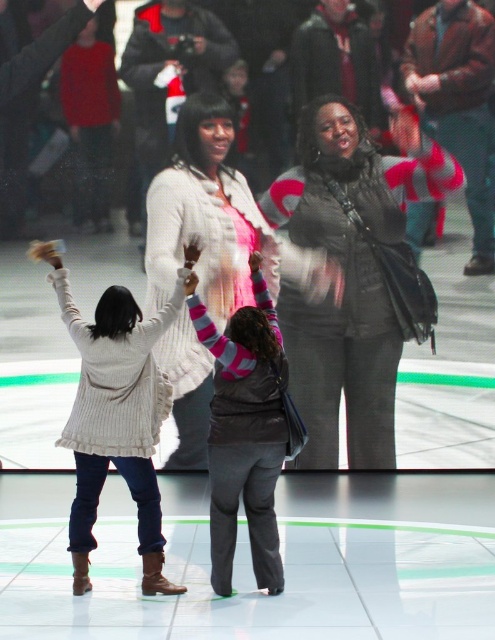
Question: Which of these objects is positioned closest to the gray fuzzy vest at center?

Choices:
 (A) matte black vest at center
 (B) white knitted sweater at center

Answer: (B)

Question: Where is white knitted sweater at center located in relation to gray fuzzy vest at center in the image?

Choices:
 (A) above
 (B) below

Answer: (A)

Question: Can you confirm if white knit sweater at center is smaller than white knitted sweater at center?

Choices:
 (A) yes
 (B) no

Answer: (A)

Question: Which object is the closest to the gray fuzzy vest at center?

Choices:
 (A) white knit sweater at center
 (B) white knitted sweater at center

Answer: (B)

Question: Which of the following is the closest to the observer?

Choices:
 (A) matte black vest at center
 (B) gray fuzzy vest at center
 (C) white knit sweater at center
 (D) white knitted sweater at center

Answer: (B)

Question: Where is white knitted sweater at center located in relation to gray fuzzy vest at center in the image?

Choices:
 (A) above
 (B) below

Answer: (A)